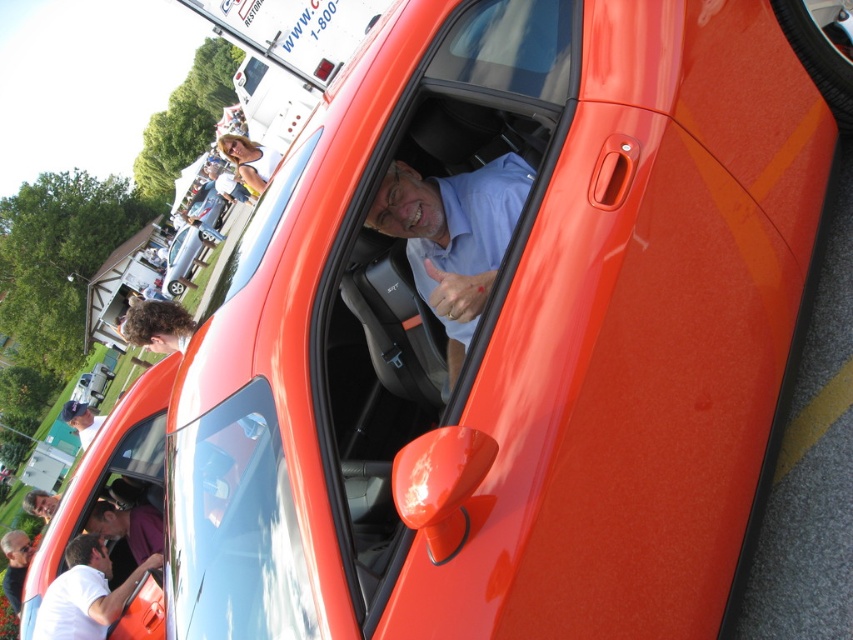
Question: Estimate the real-world distances between objects in this image. Which object is closer to the matte black car door at center?

Choices:
 (A) purple fabric shirt at center
 (B) matte black face at lower left
 (C) matte blue shirt at center
 (D) white matte shirt at lower left

Answer: (A)

Question: Is white matte shirt at lower left to the left of matte black face at lower left from the viewer's perspective?

Choices:
 (A) no
 (B) yes

Answer: (A)

Question: Does purple fabric shirt at center lie in front of matte black shirt at lower left?

Choices:
 (A) yes
 (B) no

Answer: (A)

Question: Which point is closer to the camera?

Choices:
 (A) purple fabric shirt at center
 (B) matte blue shirt at center
 (C) matte black shirt at lower left
 (D) white matte shirt at lower left

Answer: (B)

Question: Which point is farther to the camera?

Choices:
 (A) (80, 561)
 (B) (33, 509)

Answer: (B)

Question: Can you confirm if transparent glass window at center is positioned to the right of matte black face at lower left?

Choices:
 (A) no
 (B) yes

Answer: (B)